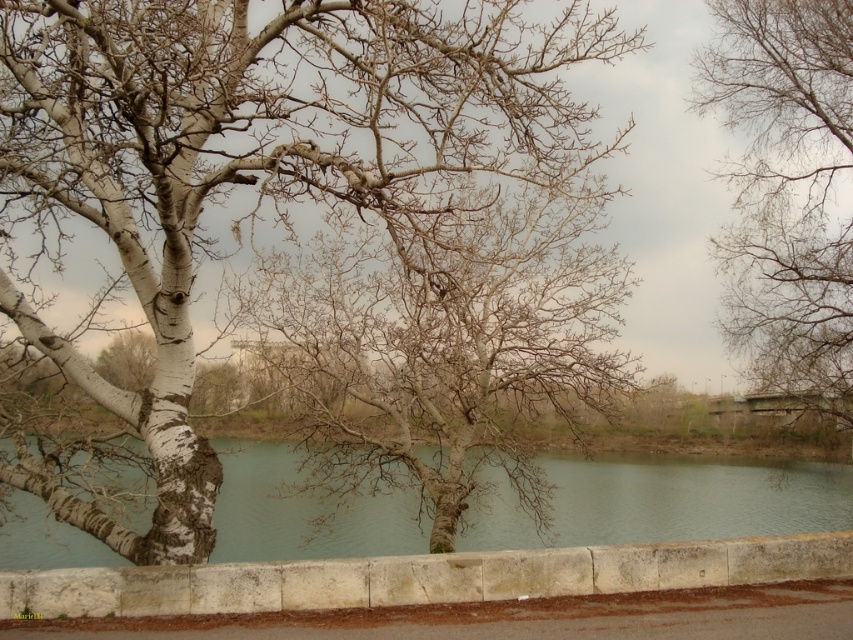
You are a painter setting up an easel to sketch the scene. You want to ensure that the bare branches at center and the stone curb at lower center are both visible in your composition. Based on their sizes, which object should you position closer to the foreground to maintain their visibility?

The bare branches at center is taller than the stone curb at lower center. To maintain visibility of both, position the stone curb at lower center closer to the foreground since it is shorter, allowing both objects to be seen clearly in the composition.

You are an artist planning to paint the scene. You want to ensure the white bark tree at center and the greenish water at center are proportionally accurate. Which object should you paint smaller?

The white bark tree at center should be painted smaller since it has a smaller size compared to the greenish water at center according to the description.

You are an artist sketching the scene and want to capture the white bark tree at center and the bare branches at center accurately. Which object should you draw first to maintain proper perspective?

The white bark tree at center should be drawn first because it is closer to the viewer than the bare branches at center, so it should be placed in front to maintain perspective.